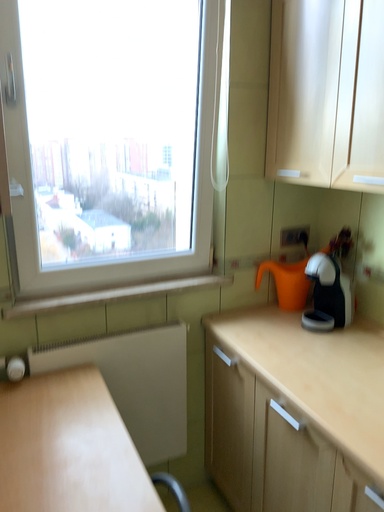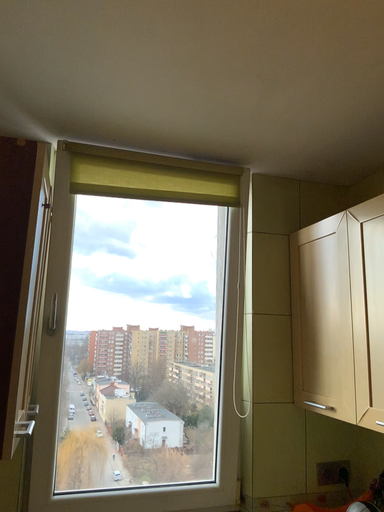
Question: How did the camera likely rotate when shooting the video?

Choices:
 (A) rotated left
 (B) rotated right

Answer: (A)